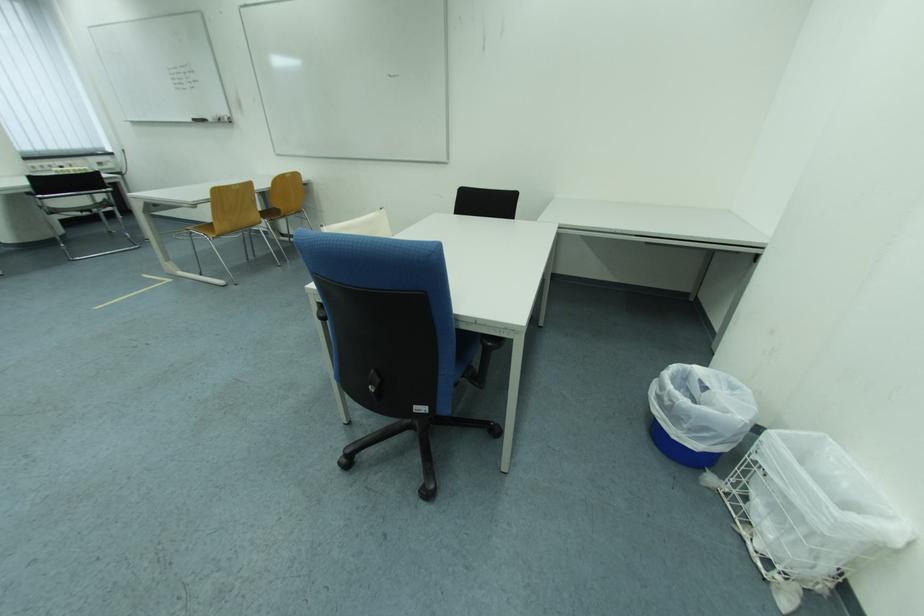
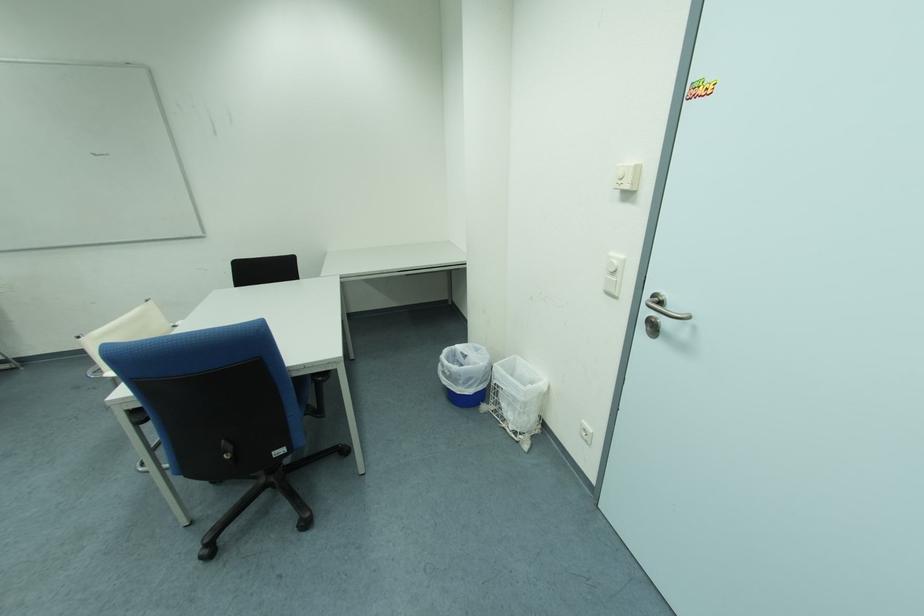
In the second image, find the point that corresponds to pixel 742 390 in the first image.

(485, 352)